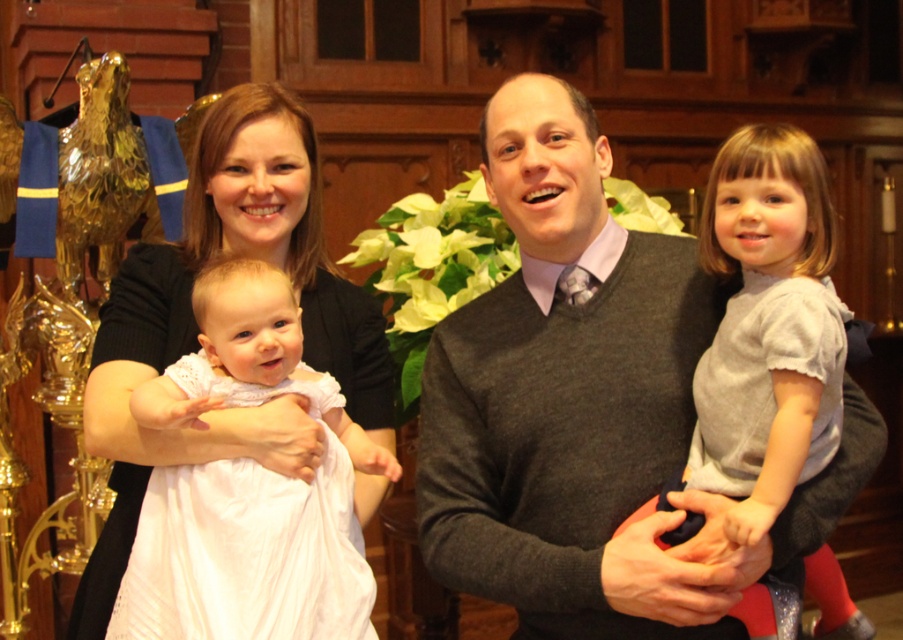
Between gray sweater at center and gray cotton dress at right, which one appears on the left side from the viewer's perspective?

gray sweater at center is more to the left.

Between gray sweater at center and gray cotton dress at right, which one has less height?

gray cotton dress at right is shorter.

Is point (632, 280) closer to camera compared to point (778, 195)?

No, (632, 280) is behind (778, 195).

This screenshot has width=903, height=640. I want to click on gray sweater at center, so click(x=589, y=406).

Can you confirm if black matte dress at center is positioned above gray cotton dress at right?

Incorrect, black matte dress at center is not positioned above gray cotton dress at right.

Is black matte dress at center to the right of gray cotton dress at right from the viewer's perspective?

Incorrect, black matte dress at center is not on the right side of gray cotton dress at right.

Where is `black matte dress at center`? The image size is (903, 640). black matte dress at center is located at coordinates (197, 328).

Is gray sweater at center smaller than black matte dress at center?

Incorrect, gray sweater at center is not smaller in size than black matte dress at center.

Who is more forward, (531, 205) or (114, 394)?

Positioned in front is point (114, 394).

Between point (597, 499) and point (183, 333), which one is positioned behind?

Positioned behind is point (183, 333).

Where is `gray sweater at center`? gray sweater at center is located at coordinates (589, 406).